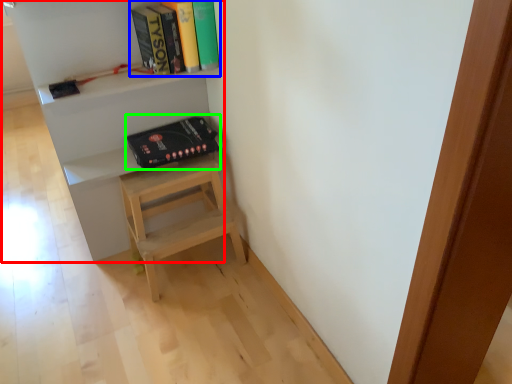
Question: Which object is the farthest from shelf (highlighted by a red box)? Choose among these: book (highlighted by a blue box) or paperback book (highlighted by a green box).

Choices:
 (A) book
 (B) paperback book

Answer: (A)